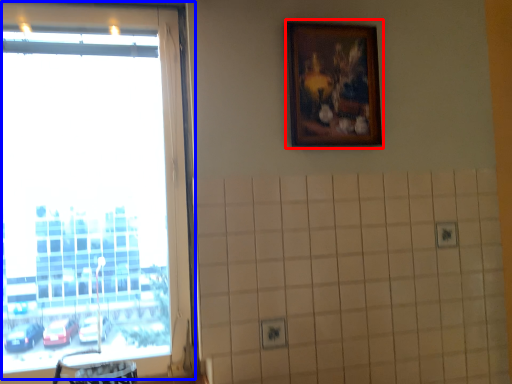
Question: Which point is closer to the camera, picture frame (highlighted by a red box) or window (highlighted by a blue box)?

Choices:
 (A) picture frame
 (B) window

Answer: (B)